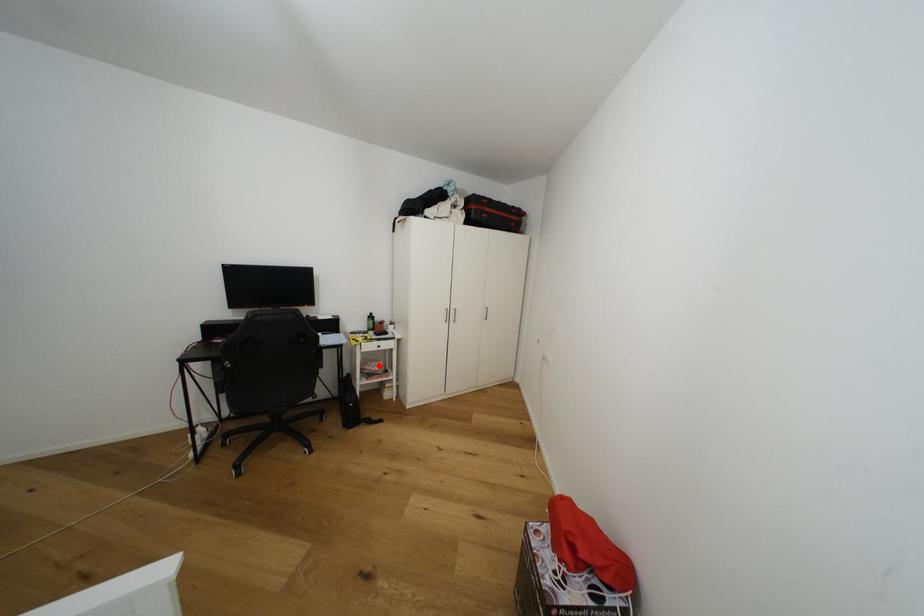
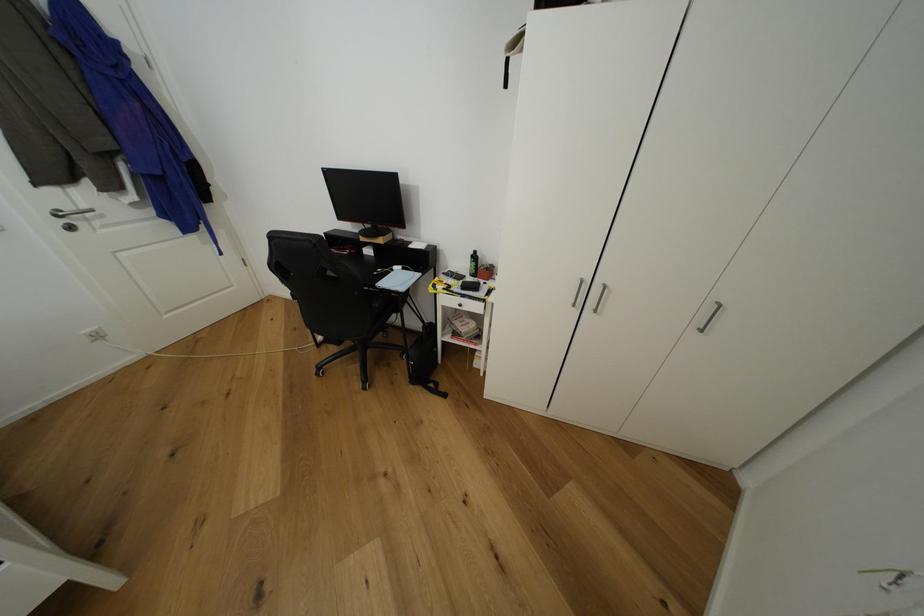
Question: I am providing you with two images of the same scene from different viewpoints. Image1 has a red point marked. In image2, the corresponding 3D location appears at what relative position? Reply with the corresponding letter.

Choices:
 (A) Closer
 (B) Farther

Answer: (A)